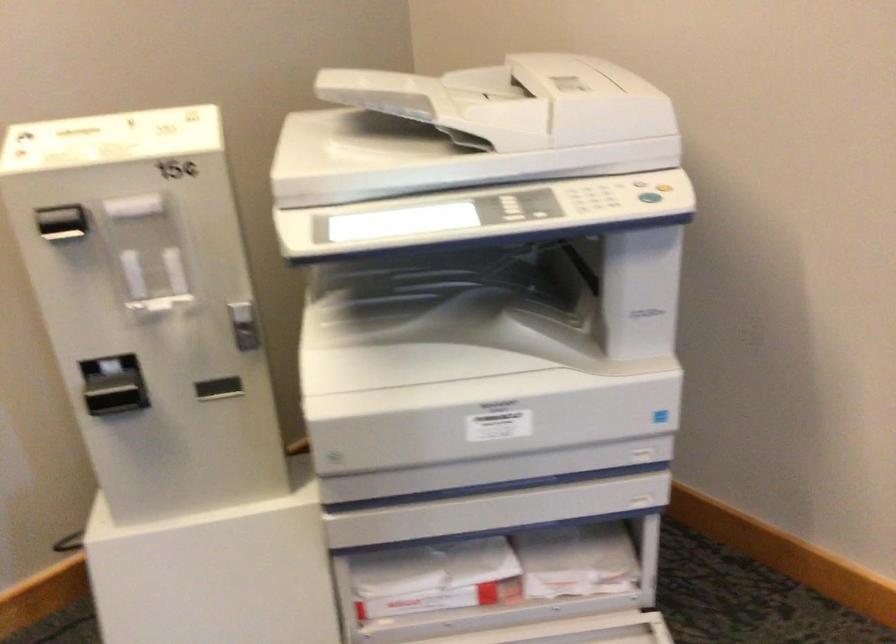
At what (x,y) coordinates should I click in order to perform the action: click on yellow button. Please return your answer as a coordinate pair (x, y). Looking at the image, I should click on (664, 185).